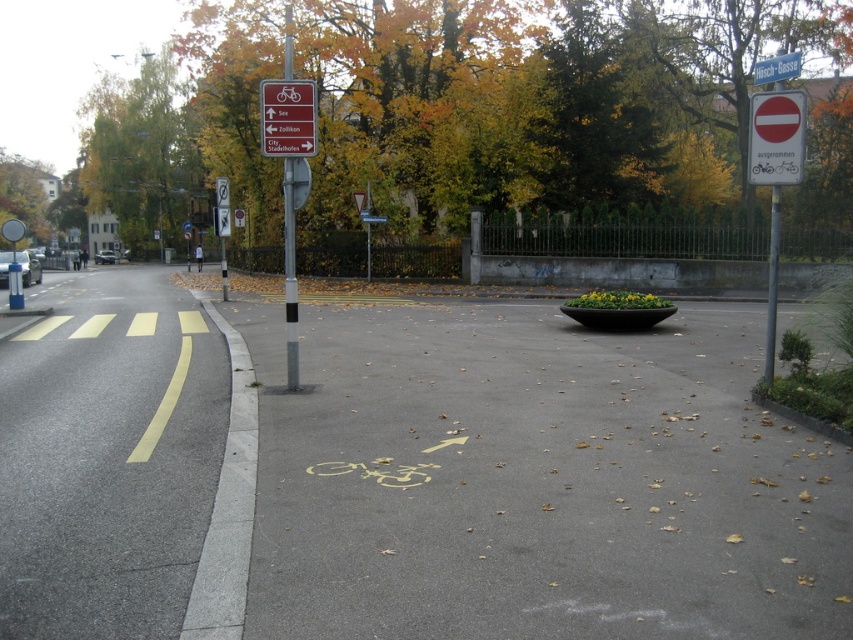
Question: Which point is closer to the camera?

Choices:
 (A) (457, 436)
 (B) (293, 374)
 (C) (751, 177)

Answer: (A)

Question: Is red plastic sign at upper center below metallic pole at right?

Choices:
 (A) no
 (B) yes

Answer: (A)

Question: Which point is closer to the camera?

Choices:
 (A) red matte stop sign at upper right
 (B) gray concrete curb at lower left

Answer: (B)

Question: Does red plastic sign at upper center appear on the right side of white plastic sign at upper center?

Choices:
 (A) no
 (B) yes

Answer: (A)

Question: Does yellow painted bicycle lane at lower center have a greater width compared to metal pole at center?

Choices:
 (A) no
 (B) yes

Answer: (B)

Question: Which object appears farthest from the camera in this image?

Choices:
 (A) red matte stop sign at upper right
 (B) metallic pole at right
 (C) red plastic sign at upper center
 (D) metal pole at center

Answer: (D)